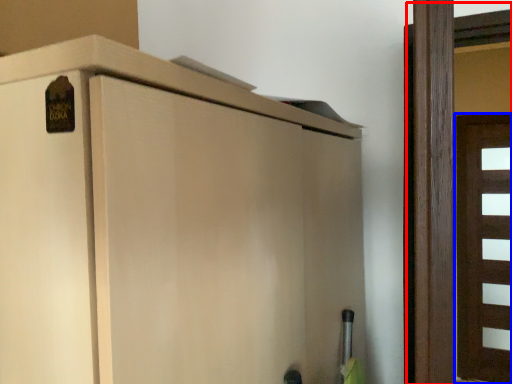
Question: Which object appears farthest to the camera in this image, door (highlighted by a red box) or door (highlighted by a blue box)?

Choices:
 (A) door
 (B) door

Answer: (B)